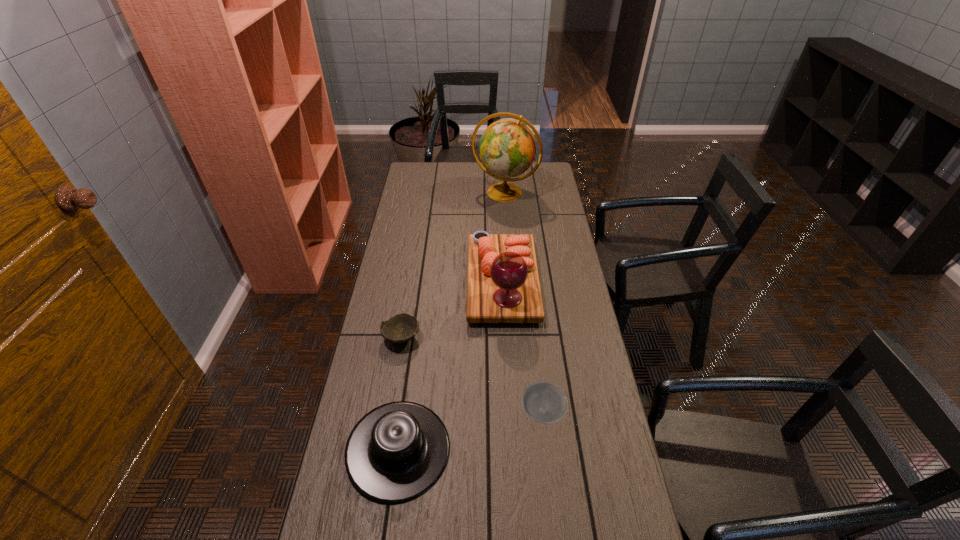
Where is `vacant space located on the right of the nearer bowl`? vacant space located on the right of the nearer bowl is located at coordinates (586, 412).

Where is `object located at the far edge`? The image size is (960, 540). object located at the far edge is located at coordinates (507, 148).

The width and height of the screenshot is (960, 540). Find the location of `dress hat positioned at the left edge`. dress hat positioned at the left edge is located at coordinates (396, 452).

I want to click on bowl present at the left edge, so click(402, 327).

At what (x,y) coordinates should I click in order to perform the action: click on globe that is at the right edge. Please return your answer as a coordinate pair (x, y). Looking at the image, I should click on (507, 148).

At what (x,y) coordinates should I click in order to perform the action: click on bowl at the right edge. Please return your answer as a coordinate pair (x, y). This screenshot has height=540, width=960. Looking at the image, I should click on (543, 402).

The image size is (960, 540). What are the coordinates of `object located at the far right corner` in the screenshot? It's located at (507, 148).

The height and width of the screenshot is (540, 960). In the image, there is a desktop. What are the coordinates of `vacant space at the far edge` in the screenshot? It's located at (455, 184).

The width and height of the screenshot is (960, 540). Identify the location of vacant point at the left edge. (398, 310).

At what (x,y) coordinates should I click in order to perform the action: click on vacant space at the right edge of the desktop. Please return your answer as a coordinate pair (x, y). Looking at the image, I should click on (580, 308).